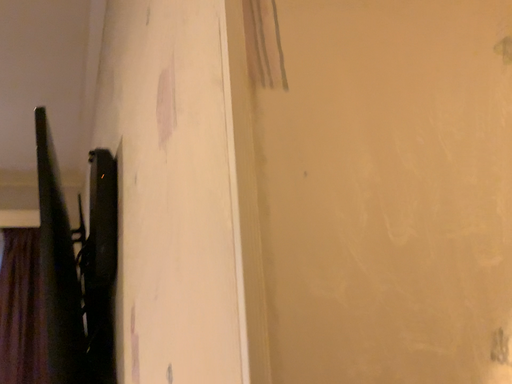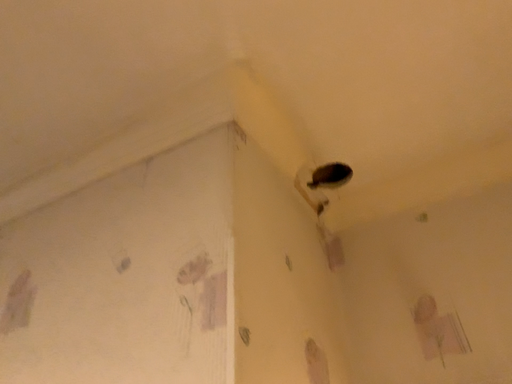
Question: Which way did the camera rotate in the video?

Choices:
 (A) rotated left
 (B) rotated right

Answer: (B)